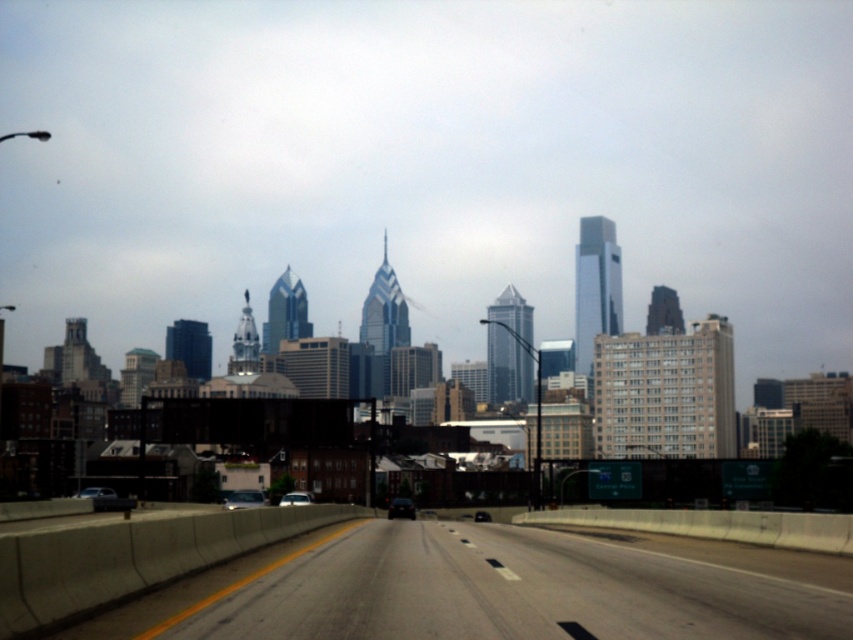
You are a delivery driver who needs to park your shiny black sedan at center in a specific spot. The parking spot is located at coordinate point 0.794, 0.471. Is your current position aligned with the parking spot?

The position of shiny black sedan at center is at point (401, 508), so yes, the shiny black sedan at center is already aligned with the parking spot at that coordinate point.

You are a driver trying to park your car in the city. You see a shiny black sedan at center and a black glossy car at center. Which one is bigger?

The shiny black sedan at center is larger in size compared to the black glossy car at center.